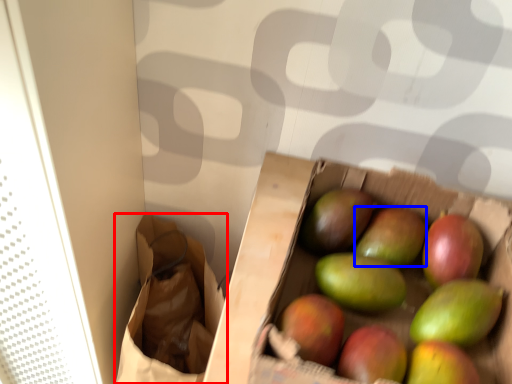
Question: Which object is closer to the camera taking this photo, shopping bag (highlighted by a red box) or apple (highlighted by a blue box)?

Choices:
 (A) shopping bag
 (B) apple

Answer: (B)